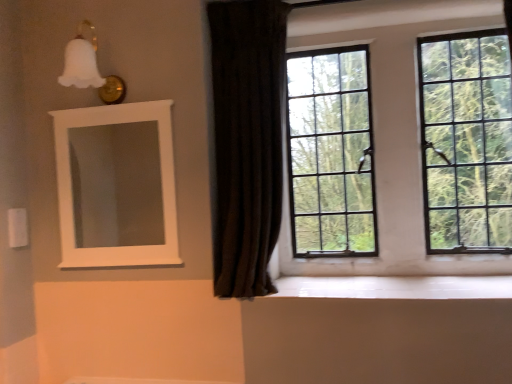
Question: From a real-world perspective, is white glossy wood at lower center physically located above or below white matte medicine cabinet at upper left?

Choices:
 (A) below
 (B) above

Answer: (A)

Question: From the image's perspective, is white glossy wood at lower center above or below white matte medicine cabinet at upper left?

Choices:
 (A) above
 (B) below

Answer: (B)

Question: Which is nearer to the clear glass window at upper right?

Choices:
 (A) white matte medicine cabinet at upper left
 (B) white glossy wood at lower center
 (C) dark velvet curtain at center

Answer: (B)

Question: Estimate the real-world distances between objects in this image. Which object is closer to the clear glass window at upper right?

Choices:
 (A) dark velvet curtain at center
 (B) white matte medicine cabinet at upper left
 (C) white glossy wood at lower center

Answer: (C)